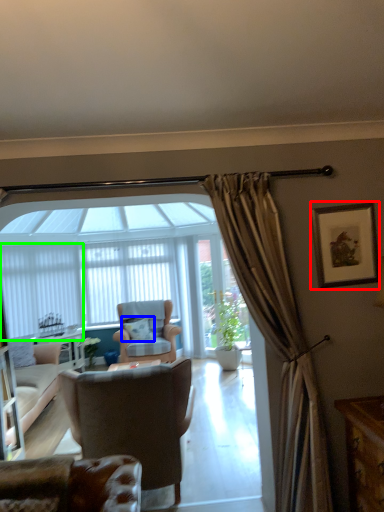
Question: Which object is the farthest from picture frame (highlighted by a red box)? Choose among these: pillow (highlighted by a blue box) or curtain (highlighted by a green box).

Choices:
 (A) pillow
 (B) curtain

Answer: (B)